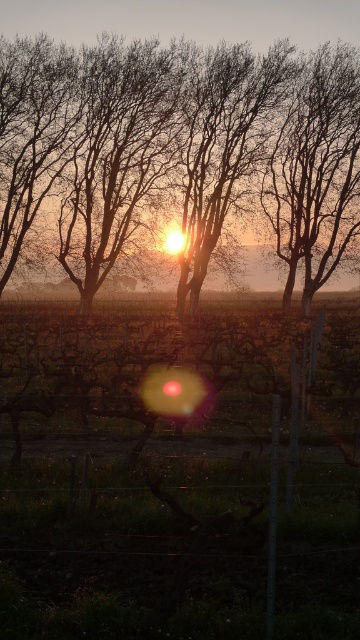
You are standing at the point marked by the coordinates point (177,150) in the image. Looking around, what object is directly in front of you?

The point (177,150) marks the silhouette bark tree at center, so the silhouette bark tree at center is directly in front of you.

In the scene shown: You are standing in the vineyard and want to take a photo of both the silhouette bark tree at center and the smooth bark tree at center. Which tree should you position yourself to the left of to include both in your shot?

You should position yourself to the left of the silhouette bark tree at center because it is located to the left of the smooth bark tree at center, so by standing there, both trees will be visible in your photo.

You are standing in the vineyard and want to take a photo of both the silhouette bark tree at center and the smooth bark tree at center. Which tree should you focus on first to ensure both are in clear view?

You should focus on the silhouette bark tree at center first since it is closer to you than the smooth bark tree at center. By focusing on the closer tree, the smooth bark tree at center will also be in focus due to depth of field.